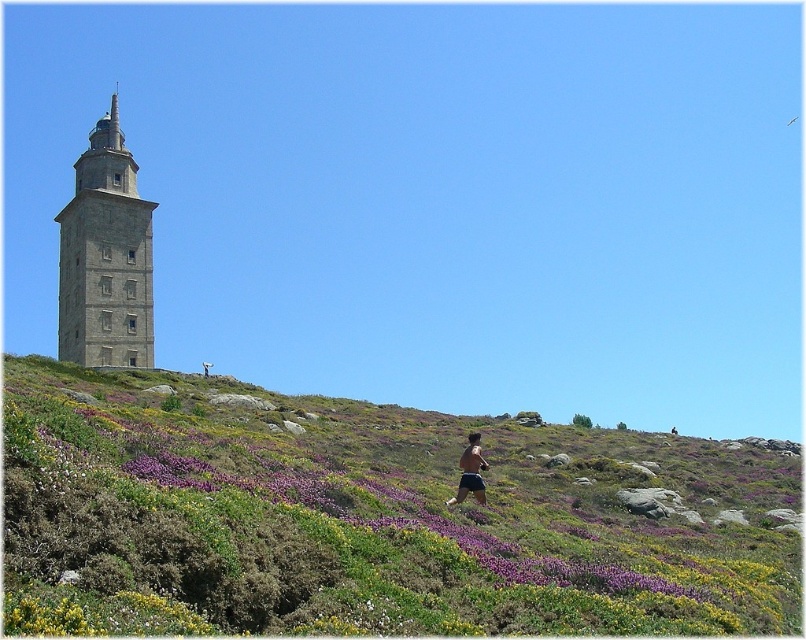
Question: Is stone tower at left positioned in front of skinny man at lower center?

Choices:
 (A) yes
 (B) no

Answer: (B)

Question: Is purple grass at upper center to the left of stone tower at left from the viewer's perspective?

Choices:
 (A) yes
 (B) no

Answer: (B)

Question: Which is farther from the stone tower at left?

Choices:
 (A) skinny man at lower center
 (B) purple grass at upper center

Answer: (A)

Question: Is purple grass at upper center smaller than skinny man at lower center?

Choices:
 (A) yes
 (B) no

Answer: (B)

Question: Which object is the farthest from the stone tower at left?

Choices:
 (A) purple grass at upper center
 (B) skinny man at lower center

Answer: (B)

Question: Considering the real-world distances, which object is farthest from the skinny man at lower center?

Choices:
 (A) stone tower at left
 (B) purple grass at upper center

Answer: (A)